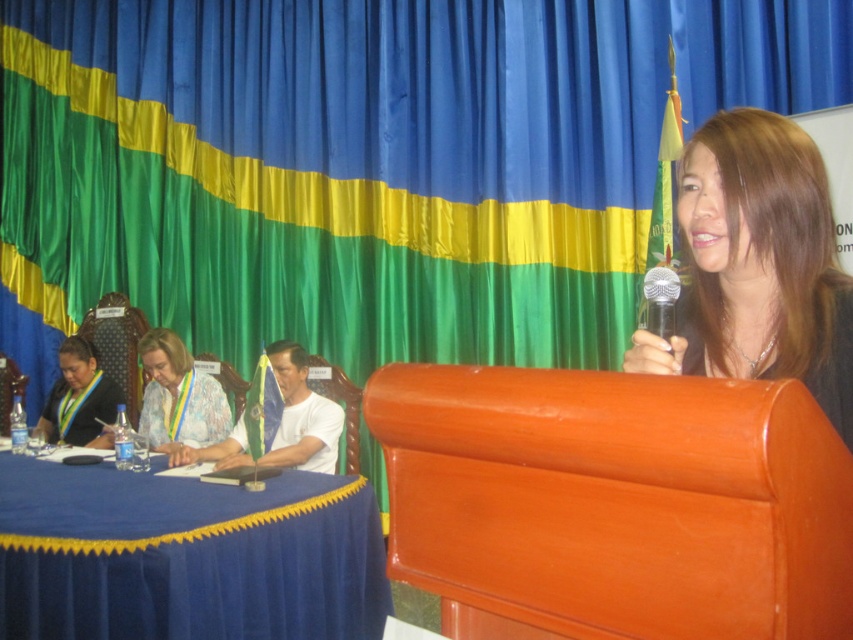
Does brown hair at upper right appear on the right side of white matte shirt at center?

Yes, brown hair at upper right is to the right of white matte shirt at center.

Between brown hair at upper right and white matte shirt at center, which one appears on the left side from the viewer's perspective?

white matte shirt at center

Is point (724, 248) less distant than point (299, 387)?

That is True.

What are the coordinates of `brown hair at upper right` in the screenshot? It's located at (758, 264).

Can you confirm if matte black shirt at left is thinner than silver metallic microphone at upper center?

No, matte black shirt at left is not thinner than silver metallic microphone at upper center.

Is matte black shirt at left shorter than silver metallic microphone at upper center?

Incorrect, matte black shirt at left's height does not fall short of silver metallic microphone at upper center's.

Image resolution: width=853 pixels, height=640 pixels. Find the location of `matte black shirt at left`. matte black shirt at left is located at coordinates (80, 397).

At what (x,y) coordinates should I click in order to perform the action: click on matte black shirt at left. Please return your answer as a coordinate pair (x, y). Looking at the image, I should click on (80, 397).

In the scene shown: Which is above, blue fabric table at lower left or silver metallic microphone at upper center?

Positioned higher is silver metallic microphone at upper center.

Does blue fabric table at lower left have a larger size compared to silver metallic microphone at upper center?

Indeed, blue fabric table at lower left has a larger size compared to silver metallic microphone at upper center.

Is point (70, 579) farther from viewer compared to point (664, 308)?

Yes, point (70, 579) is farther from viewer.

In order to click on blue fabric table at lower left in this screenshot , I will do `click(186, 556)`.